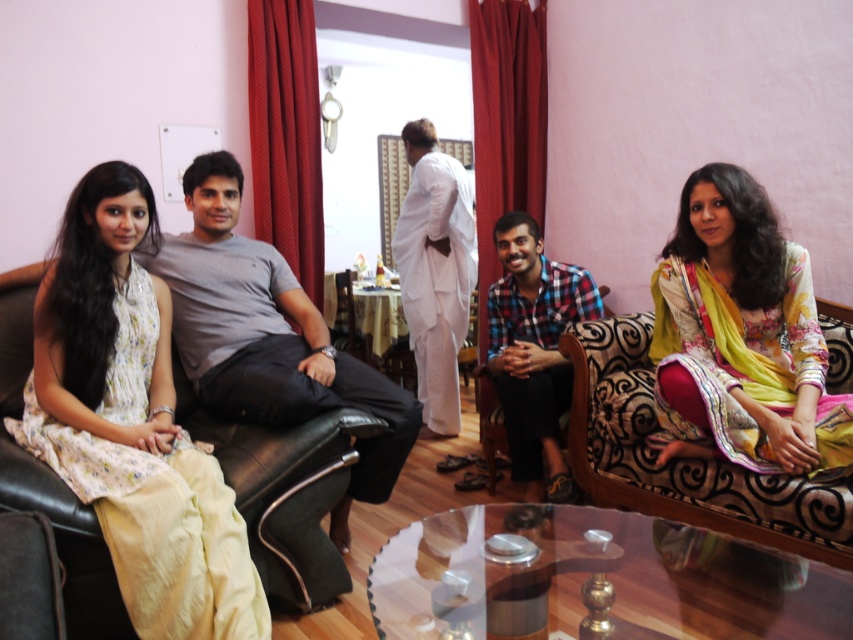
Question: Is floral chiffon dress at center thinner than black leather chair at center?

Choices:
 (A) yes
 (B) no

Answer: (B)

Question: Is gray cotton t-shirt at left behind floral-patterned fabric couch at right?

Choices:
 (A) no
 (B) yes

Answer: (B)

Question: Which point is closer to the camera taking this photo?

Choices:
 (A) (628, 481)
 (B) (737, 433)
 (C) (172, 525)
 (D) (334, 540)

Answer: (C)

Question: Among these objects, which one is nearest to the camera?

Choices:
 (A) plaid fabric shirt at center
 (B) floral fabric dress at center
 (C) floral chiffon dress at center
 (D) floral-patterned fabric couch at right

Answer: (B)

Question: Can you confirm if gray cotton t-shirt at left is positioned to the right of white cotton kurta at center?

Choices:
 (A) no
 (B) yes

Answer: (A)

Question: Which of the following is the closest to the observer?

Choices:
 (A) black leather chair at center
 (B) floral fabric dress at center
 (C) white cotton kurta at center

Answer: (B)